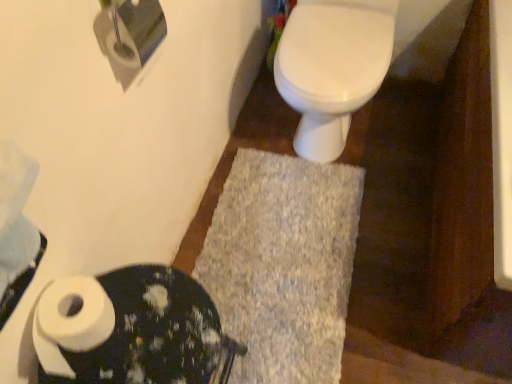
In order to click on vacant space that's between white glossy toilet at center and gray shaggy bath mat at center in this screenshot , I will do `click(286, 146)`.